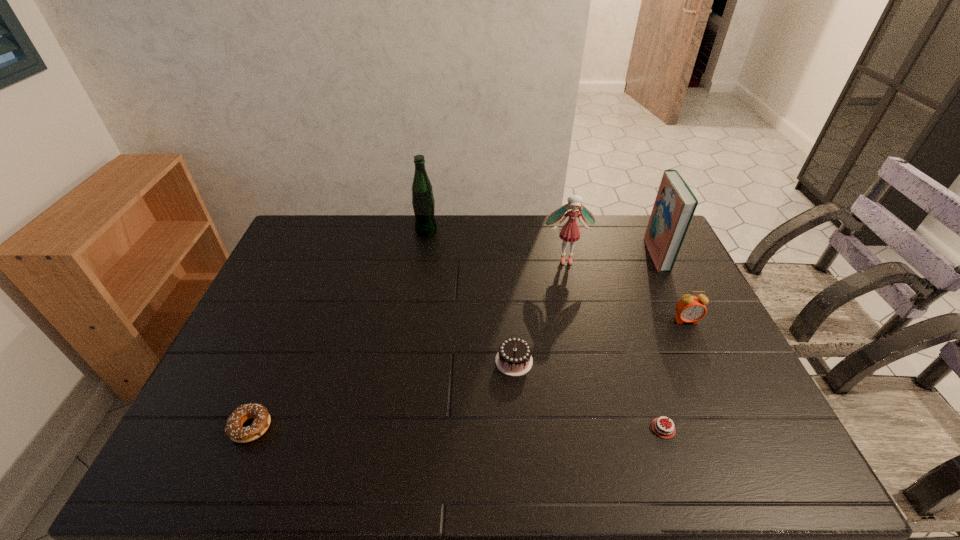
Where is `free spot between the right chocolate cake and the doll`? This screenshot has height=540, width=960. free spot between the right chocolate cake and the doll is located at coordinates (614, 344).

You are a GUI agent. You are given a task and a screenshot of the screen. Output one action in this format:
    pyautogui.click(x=<x>, y=<y>)
    Task: Click on the free area in between the third nearest object and the fourth shortest object
    The height and width of the screenshot is (540, 960).
    Given the screenshot: What is the action you would take?
    pyautogui.click(x=600, y=341)

Where is `vacant area that lies between the doughnut and the fourth farthest object`? The height and width of the screenshot is (540, 960). vacant area that lies between the doughnut and the fourth farthest object is located at coordinates (468, 374).

What are the coordinates of `free space between the beer bottle and the fourth object from left to right` in the screenshot? It's located at (496, 245).

The image size is (960, 540). In order to click on empty space between the hardback book and the fourth tallest object in this screenshot , I will do `click(671, 287)`.

This screenshot has width=960, height=540. Identify the location of object that is the fourth nearest to the fourth nearest object. (514, 358).

Where is `object that is the sixth nearest to the beer bottle`? object that is the sixth nearest to the beer bottle is located at coordinates (661, 428).